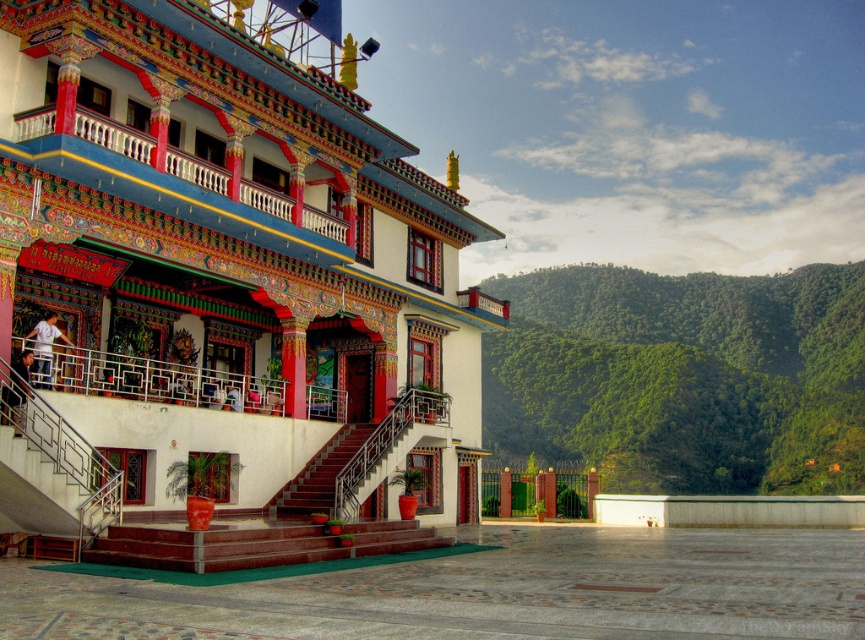
Does metallic staircase at lower left have a smaller size compared to white cotton shirt at upper left?

Indeed, metallic staircase at lower left has a smaller size compared to white cotton shirt at upper left.

Between point (20, 529) and point (40, 348), which one is positioned behind?

The point (40, 348) is more distant.

The width and height of the screenshot is (865, 640). I want to click on metallic staircase at lower left, so click(42, 493).

Which is behind, point (29, 499) or point (364, 429)?

The point (364, 429) is behind.

Is metallic staircase at lower left to the right of maroon wooden stairs at center from the viewer's perspective?

No, metallic staircase at lower left is not to the right of maroon wooden stairs at center.

In order to click on metallic staircase at lower left in this screenshot , I will do `click(42, 493)`.

Who is shorter, green leafy hillside at upper right or white cotton shirt at upper left?

white cotton shirt at upper left is shorter.

What do you see at coordinates (684, 376) in the screenshot?
I see `green leafy hillside at upper right` at bounding box center [684, 376].

At what (x,y) coordinates should I click in order to perform the action: click on green leafy hillside at upper right. Please return your answer as a coordinate pair (x, y). The width and height of the screenshot is (865, 640). Looking at the image, I should click on (684, 376).